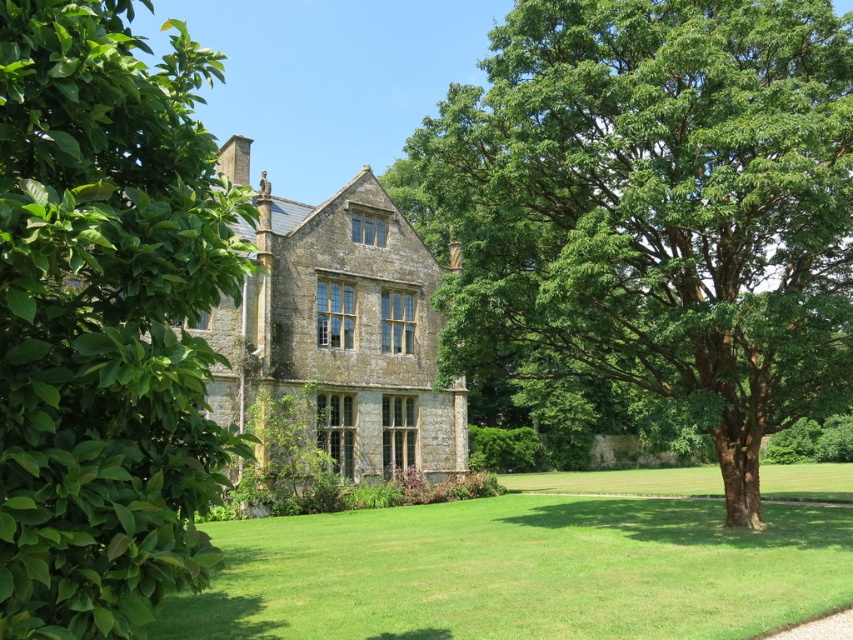
You are standing in the middle of the green grass lawn at center and want to walk to the green leafy tree at right. Which direction should you head towards?

The green leafy tree at right is positioned on the left side of green grass lawn at center, so you should head towards the left direction to reach it.

You are a gardener planning to plant a new flower bed between the green leafy tree at right and the green grass lawn at center. Considering their heights, which object will cast a shadow over the flower bed during the afternoon when the sun is low in the sky?

The green leafy tree at right will cast a shadow over the flower bed because it is taller than the green grass lawn at center.

You are a landscape architect designing a garden path that needs to pass between the green leafy tree at right and the green leafy bush at left. Based on their sizes, which side of the path should be wider to accommodate the larger plant?

The path should be wider on the side near the green leafy tree at right because its width is larger than the green leafy bush at left.